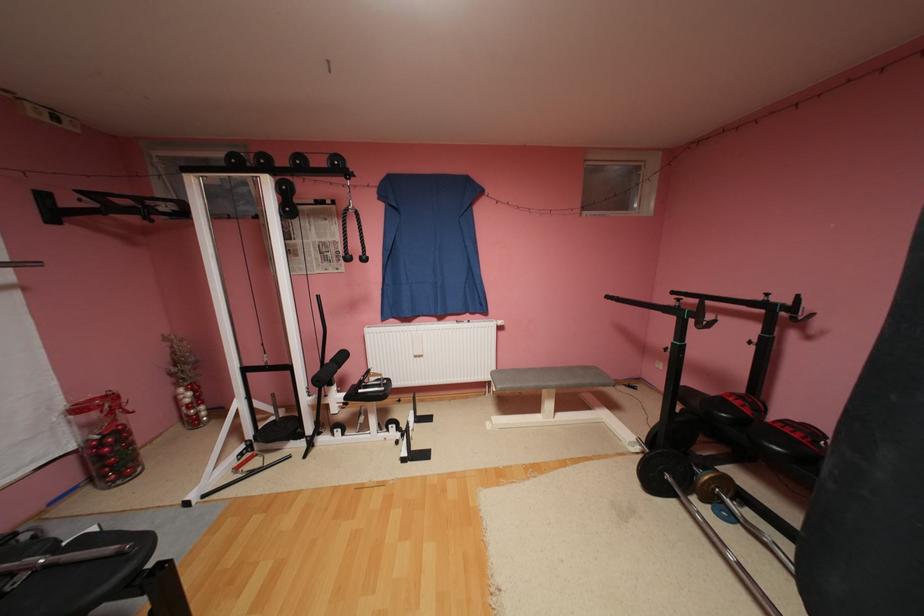
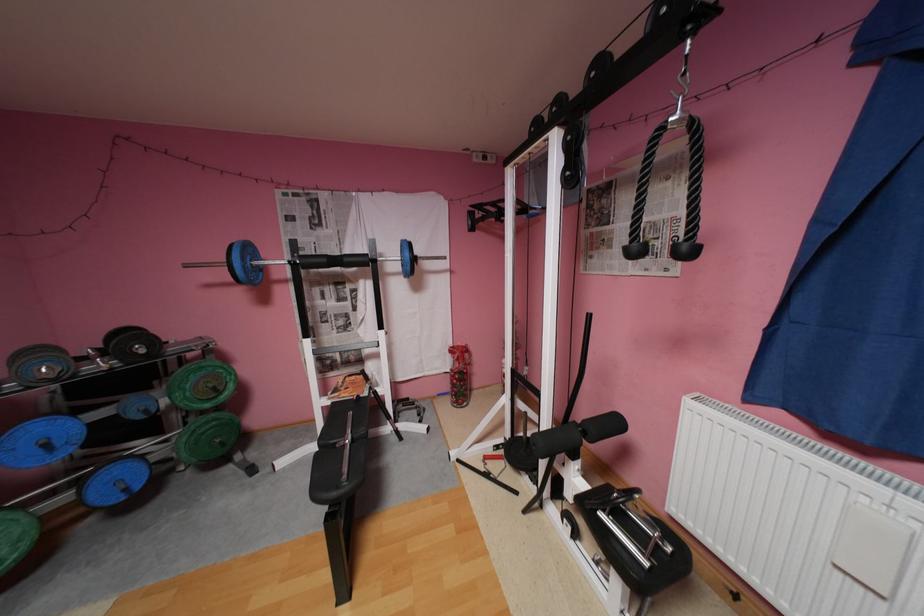
Locate, in the second image, the point that corresponds to point 108,446 in the first image.

(462, 377)